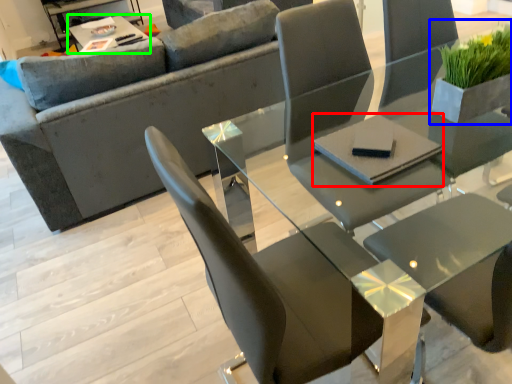
Question: Which is nearer to the pad (highlighted by a red box)? houseplant (highlighted by a blue box) or table (highlighted by a green box).

Choices:
 (A) houseplant
 (B) table

Answer: (A)